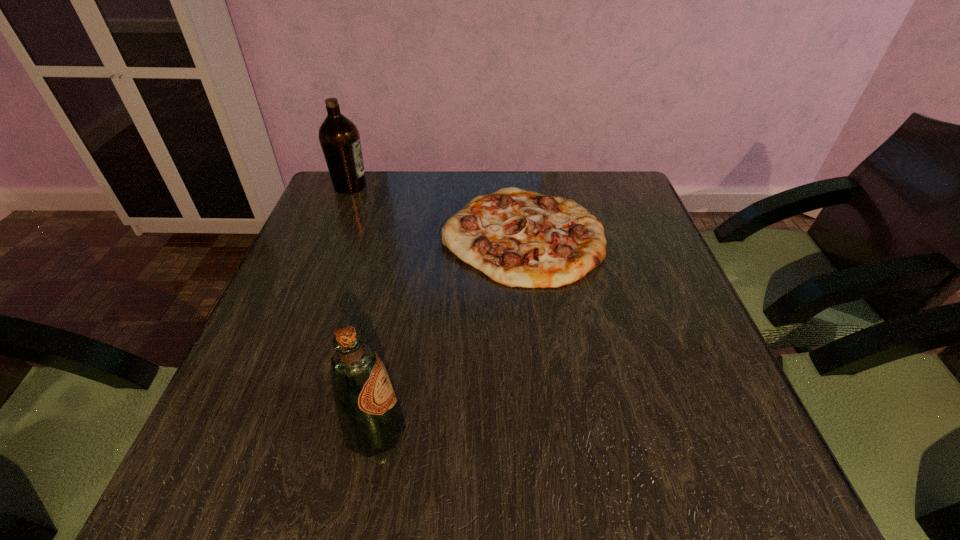
This screenshot has height=540, width=960. In order to click on pizza that is at the far edge in this screenshot , I will do `click(518, 238)`.

At what (x,y) coordinates should I click in order to perform the action: click on object that is at the near edge. Please return your answer as a coordinate pair (x, y). Looking at the image, I should click on (371, 420).

Locate an element on the screen. This screenshot has width=960, height=540. object positioned at the left edge is located at coordinates (339, 138).

Identify the location of object at the right edge. (518, 238).

Locate an element on the screen. The height and width of the screenshot is (540, 960). object at the far left corner is located at coordinates (339, 138).

I want to click on object located at the far right corner, so coord(518,238).

At what (x,y) coordinates should I click in order to perform the action: click on free space at the far edge of the desktop. Please return your answer as a coordinate pair (x, y). The width and height of the screenshot is (960, 540). Looking at the image, I should click on (464, 191).

In the image, there is a desktop. Identify the location of free space at the near edge. The width and height of the screenshot is (960, 540). (619, 471).

Locate an element on the screen. Image resolution: width=960 pixels, height=540 pixels. free space at the left edge of the desktop is located at coordinates (271, 363).

This screenshot has height=540, width=960. In the image, there is a desktop. What are the coordinates of `free space at the right edge` in the screenshot? It's located at (677, 364).